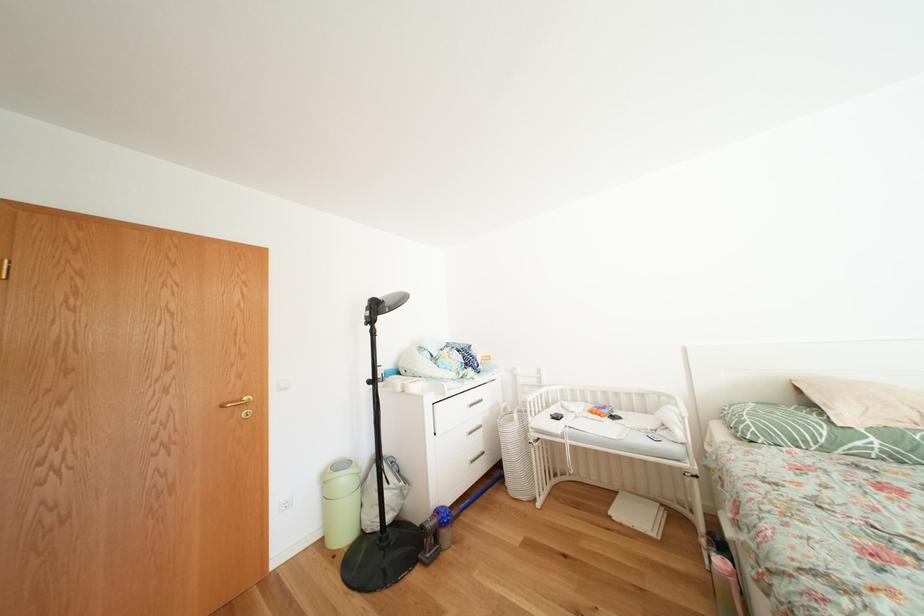
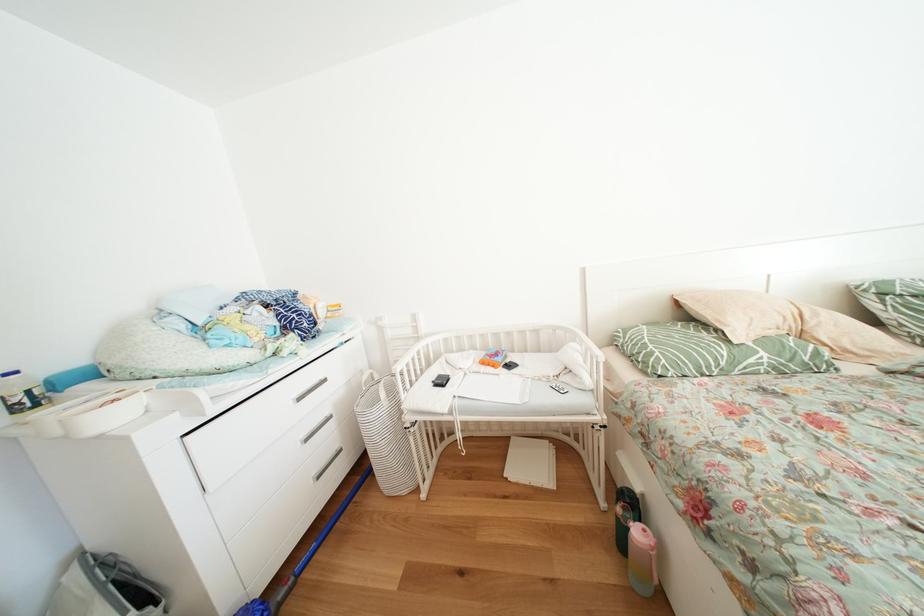
Locate, in the second image, the point that corresponds to [712,546] in the first image.

(628, 515)